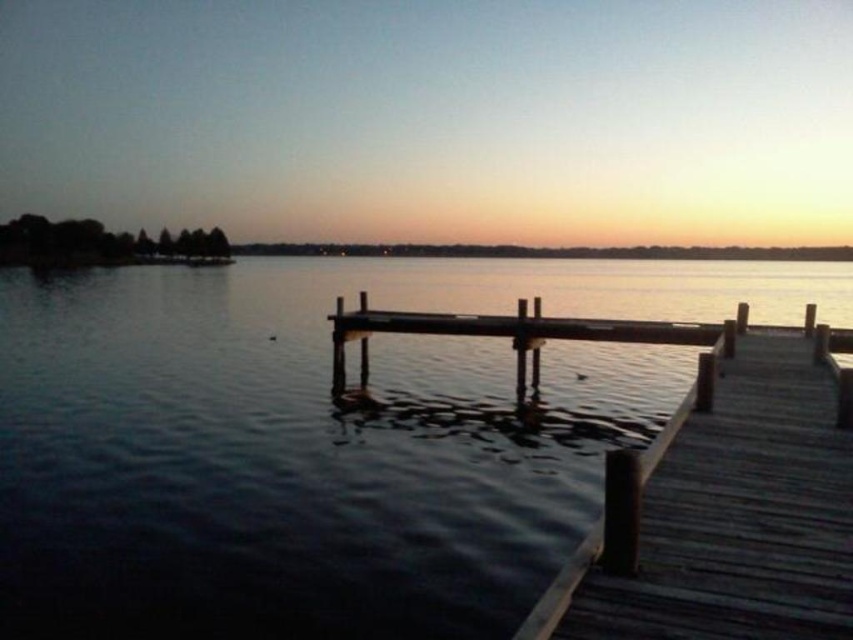
Which is below, smooth water at center or wooden dock at center?

wooden dock at center

Does smooth water at center have a lesser width compared to wooden dock at center?

Incorrect, smooth water at center's width is not less than wooden dock at center's.

Find the location of a particular element. The height and width of the screenshot is (640, 853). smooth water at center is located at coordinates (323, 440).

You are a GUI agent. You are given a task and a screenshot of the screen. Output one action in this format:
    pyautogui.click(x=<x>, y=<y>)
    Task: Click on the smooth water at center
    
    Given the screenshot: What is the action you would take?
    pyautogui.click(x=323, y=440)